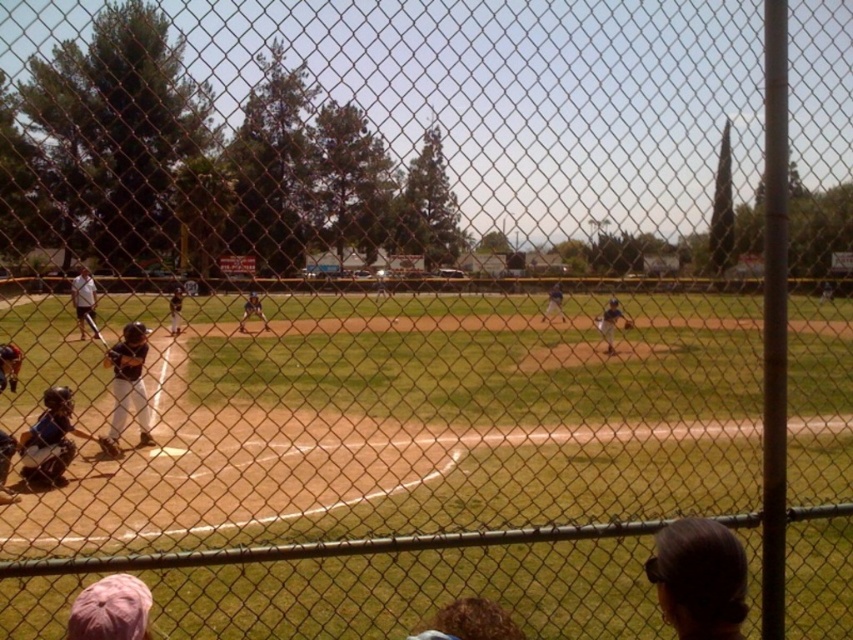
You are a spectator standing behind the chain link fence watching the baseball game. You notice two blue items in the image. Which one is closer to you? The blue matte catcher at lower left or the blue uniform at center?

The blue matte catcher at lower left is closer to you because smaller objects in the foreground appear smaller than those further away, but according to the description, it is smaller than the blue uniform at center. Wait, that might be conflicting. Let me think again. Hmm, actually, if the blue matte catcher is smaller than the blue uniform at center, that might mean the catcher is farther away. Wait, no, in perspective, closer objects are larger. So if the catcher is smaller, it might be farther. But the

You are standing at the point labeled as point (84, 330) and want to take a photo of the entire baseball field. The camera you have can capture a maximum distance of 25 meters. Will you be able to capture the entire field in one shot?

The distance between point (84, 330) and the camera is 25.94 meters, which exceeds the camera maximum distance of 25 meters. Therefore, you will not be able to capture the entire field in one shot.

You are a spectator standing behind the chain link fence watching the baseball game. You notice the blue matte catcher at lower left and the matte blue baseball glove at center. Which object is nearer to you?

The blue matte catcher at lower left is closer to the viewer than the matte blue baseball glove at center.